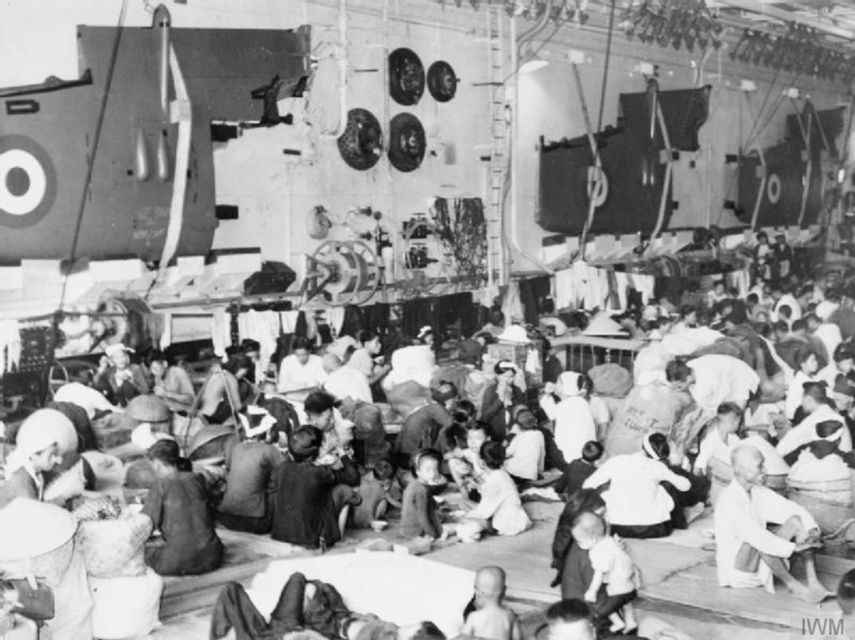
Is white cloth at center above white cloth baby at center?

Indeed, white cloth at center is positioned over white cloth baby at center.

From the picture: Is white cloth at center positioned at the back of white cloth baby at center?

Yes, it is.

Is point (783, 500) farther from camera compared to point (622, 602)?

Yes.

Locate an element on the screen. white cloth at center is located at coordinates (762, 532).

I want to click on white cloth baby at center, so click(604, 572).

Who is more distant from viewer, [593,600] or [516,618]?

Point [593,600]

Between point (593, 554) and point (479, 620), which one is positioned in front?

Point (479, 620) is more forward.

Locate an element on the screen. The image size is (855, 640). white cloth baby at center is located at coordinates (604, 572).

What do you see at coordinates (762, 532) in the screenshot? I see `white cloth at center` at bounding box center [762, 532].

Is point (777, 570) positioned before point (486, 628)?

No, (777, 570) is behind (486, 628).

Which is behind, point (712, 528) or point (485, 600)?

Point (712, 528)

The width and height of the screenshot is (855, 640). I want to click on white cloth at center, so click(x=762, y=532).